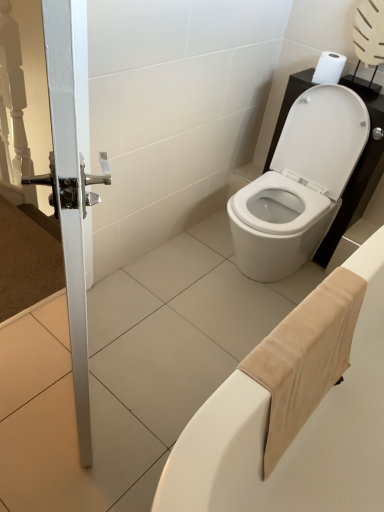
Question: From a real-world perspective, is beige fabric towel at lower right located beneath white matte toilet paper at upper right?

Choices:
 (A) yes
 (B) no

Answer: (A)

Question: Is beige fabric towel at lower right to the right of white matte toilet paper at upper right from the viewer's perspective?

Choices:
 (A) yes
 (B) no

Answer: (B)

Question: Considering the relative sizes of beige fabric towel at lower right and white matte toilet paper at upper right in the image provided, is beige fabric towel at lower right smaller than white matte toilet paper at upper right?

Choices:
 (A) yes
 (B) no

Answer: (B)

Question: From the image's perspective, is beige fabric towel at lower right located above white matte toilet paper at upper right?

Choices:
 (A) yes
 (B) no

Answer: (B)

Question: Is beige fabric towel at lower right bigger than white matte toilet paper at upper right?

Choices:
 (A) yes
 (B) no

Answer: (A)

Question: Is beige fabric towel at lower right aimed at white matte toilet paper at upper right?

Choices:
 (A) yes
 (B) no

Answer: (B)

Question: Is white glossy toilet at center outside white matte toilet paper at upper right?

Choices:
 (A) no
 (B) yes

Answer: (B)

Question: From a real-world perspective, is white glossy toilet at center over white matte toilet paper at upper right?

Choices:
 (A) yes
 (B) no

Answer: (B)

Question: Is white glossy toilet at center far from white matte toilet paper at upper right?

Choices:
 (A) yes
 (B) no

Answer: (B)

Question: Is white glossy toilet at center with white matte toilet paper at upper right?

Choices:
 (A) yes
 (B) no

Answer: (B)

Question: Can you confirm if white glossy toilet at center is taller than white matte toilet paper at upper right?

Choices:
 (A) no
 (B) yes

Answer: (B)

Question: Would you say white glossy toilet at center contains white matte toilet paper at upper right?

Choices:
 (A) no
 (B) yes

Answer: (A)

Question: Considering the relative sizes of white glossy door handle at left and white glossy toilet at center in the image provided, is white glossy door handle at left wider than white glossy toilet at center?

Choices:
 (A) yes
 (B) no

Answer: (B)